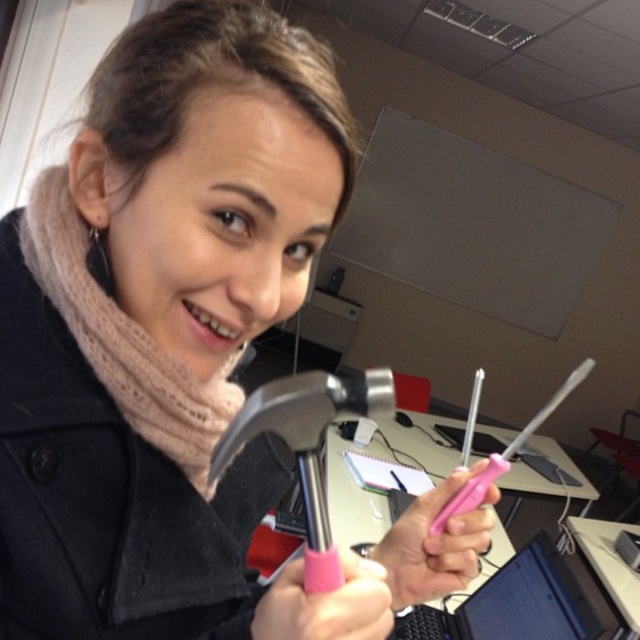
Can you confirm if knitted beige scarf at upper left is smaller than brushed metal hammer at center?

Actually, knitted beige scarf at upper left might be larger than brushed metal hammer at center.

Between knitted beige scarf at upper left and brushed metal hammer at center, which one is positioned lower?

brushed metal hammer at center is lower down.

Between point (96, 307) and point (305, 376), which one is positioned behind?

Point (96, 307)

Where is `knitted beige scarf at upper left`? The width and height of the screenshot is (640, 640). knitted beige scarf at upper left is located at coordinates (124, 339).

Between pink plastic screwdriver at center and pink plastic screwdriver at lower center, which one appears on the left side from the viewer's perspective?

From the viewer's perspective, pink plastic screwdriver at lower center appears more on the left side.

Where is `pink plastic screwdriver at center`? pink plastic screwdriver at center is located at coordinates (435, 544).

Does point (445, 532) lie in front of point (352, 579)?

No, it is not.

At what (x,y) coordinates should I click in order to perform the action: click on pink plastic screwdriver at center. Please return your answer as a coordinate pair (x, y). Looking at the image, I should click on (435, 544).

Who is lower down, knitted beige scarf at upper left or pink plastic screwdriver at lower center?

Positioned lower is pink plastic screwdriver at lower center.

Is point (128, 408) closer to camera compared to point (353, 563)?

No, it is not.

Measure the distance between knitted beige scarf at upper left and camera.

knitted beige scarf at upper left and camera are 16.08 inches apart from each other.

The image size is (640, 640). Identify the location of knitted beige scarf at upper left. (124, 339).